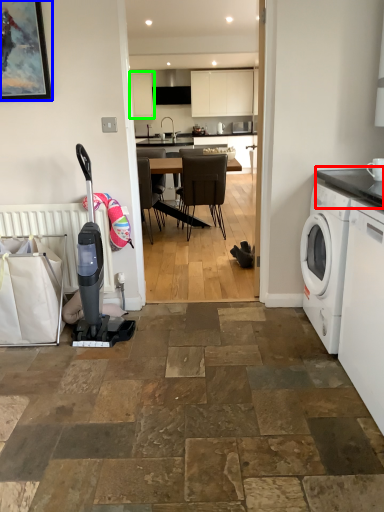
Question: Based on their relative distances, which object is farther from countertop (highlighted by a red box)? Choose from picture frame (highlighted by a blue box) and cabinetry (highlighted by a green box).

Choices:
 (A) picture frame
 (B) cabinetry

Answer: (B)